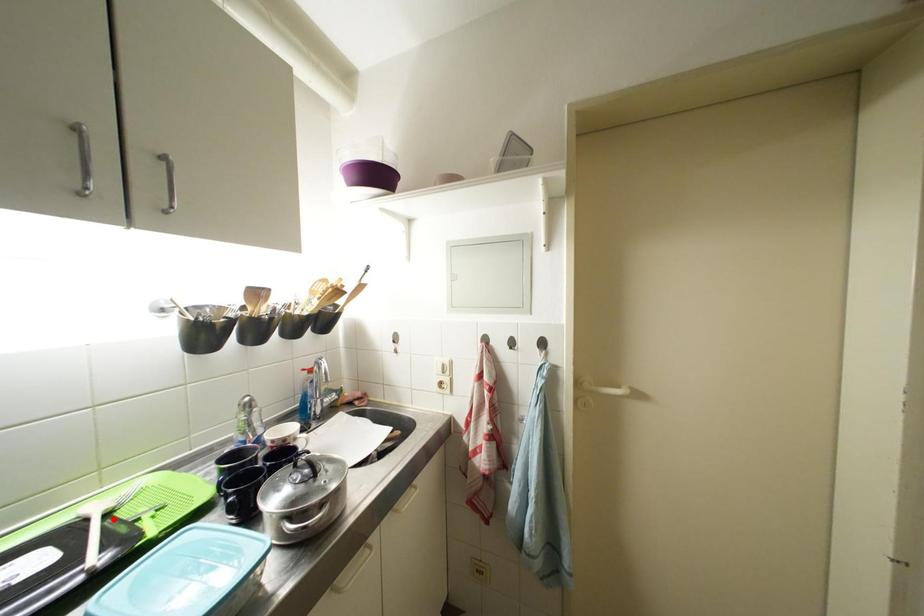
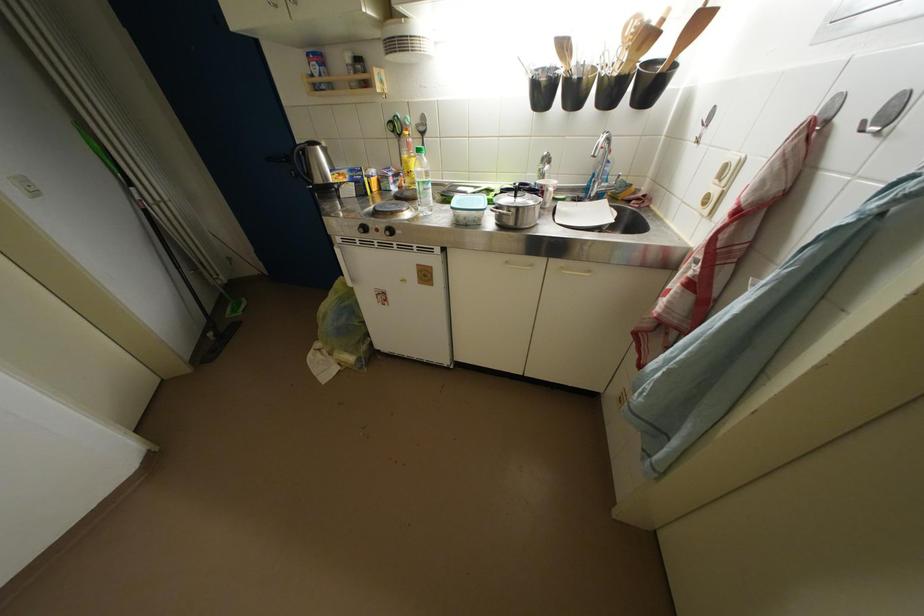
Locate, in the second image, the point that corresponds to the highlighted location in the first image.

(495, 193)